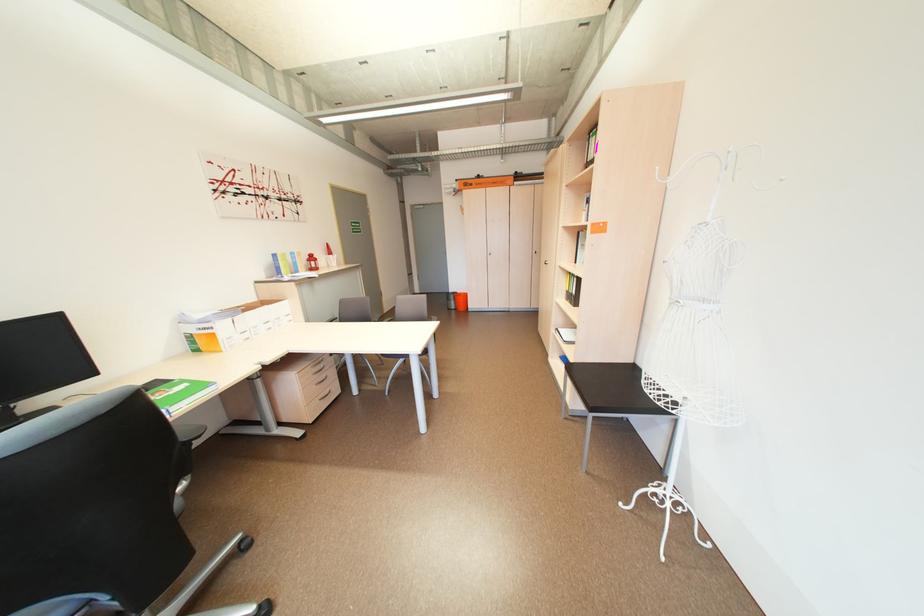
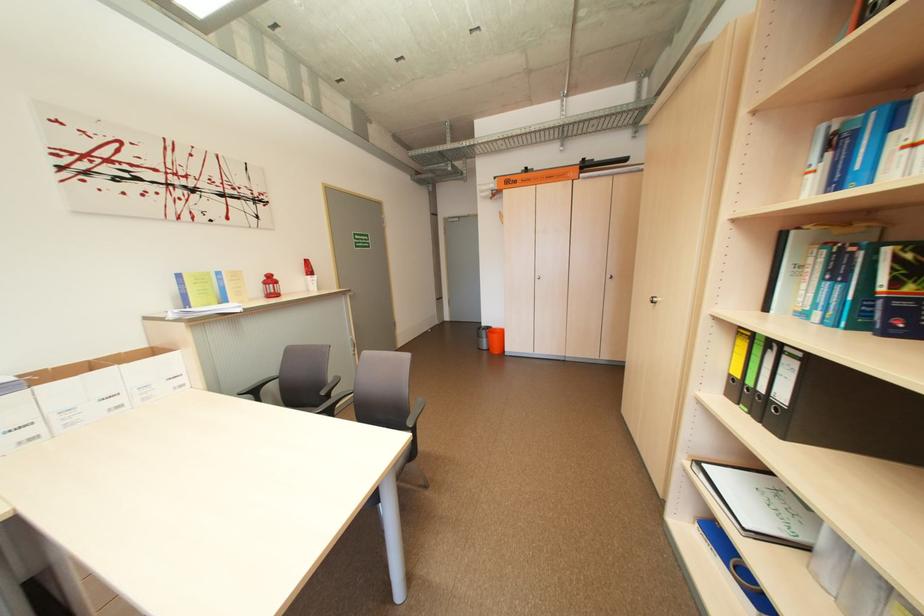
In the second image, find the point that corresponds to (x=253, y=312) in the first image.

(43, 384)